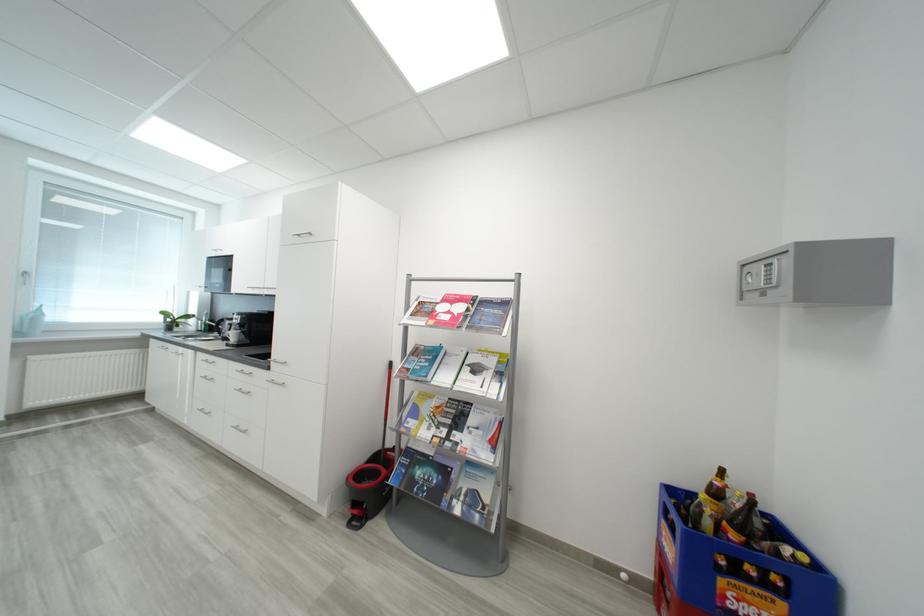
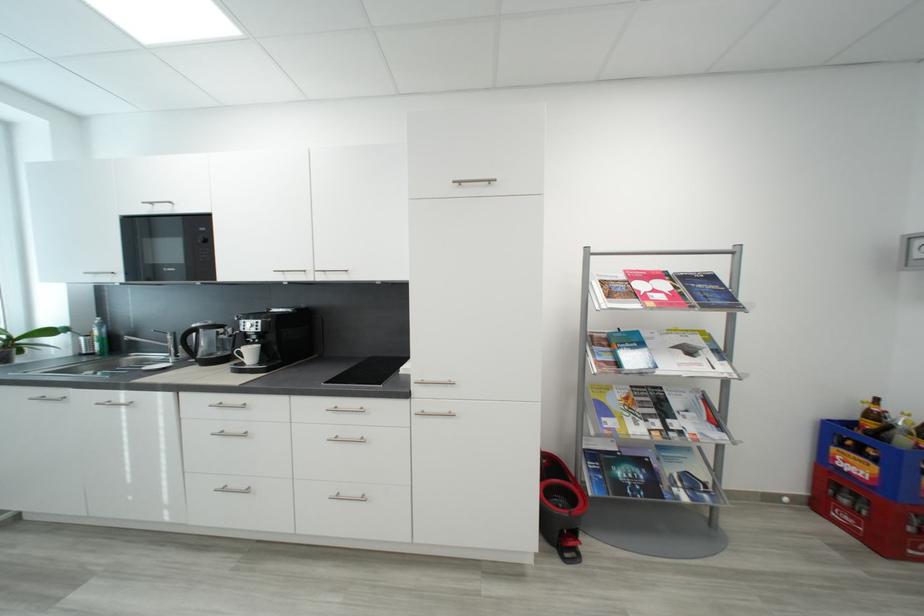
Locate, in the second image, the point that corresponds to (x=512, y=305) in the first image.

(718, 280)